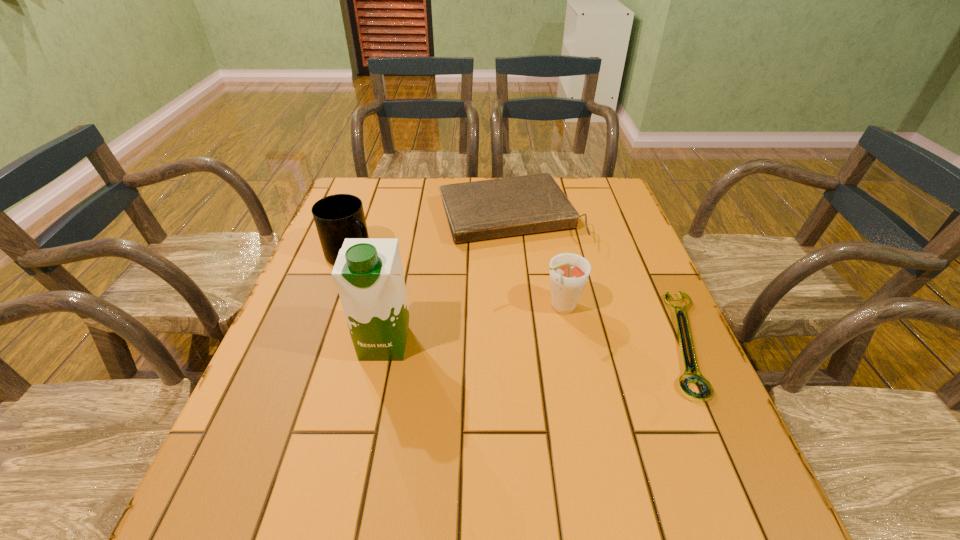
At what (x,y) coordinates should I click in order to perform the action: click on wrench situated at the right edge. Please return your answer as a coordinate pair (x, y). Image resolution: width=960 pixels, height=540 pixels. Looking at the image, I should click on (697, 378).

Identify the location of paperback book present at the right edge. The height and width of the screenshot is (540, 960). (478, 210).

Locate an element on the screen. The width and height of the screenshot is (960, 540). object present at the far right corner is located at coordinates (478, 210).

In the image, there is a desktop. Identify the location of vacant space at the near edge. Image resolution: width=960 pixels, height=540 pixels. (333, 421).

Identify the location of free space at the left edge. (336, 346).

This screenshot has width=960, height=540. In order to click on blank area at the right edge in this screenshot , I will do `click(629, 227)`.

You are a GUI agent. You are given a task and a screenshot of the screen. Output one action in this format:
    pyautogui.click(x=<x>, y=<y>)
    Task: Click on the free location at the near right corner of the desktop
    The image size is (960, 540).
    Given the screenshot: What is the action you would take?
    pyautogui.click(x=716, y=452)

This screenshot has width=960, height=540. Identify the location of free point between the root beer and the second shortest object. (535, 261).

The image size is (960, 540). I want to click on free space between the paperback book and the root beer, so click(535, 261).

At what (x,y) coordinates should I click in order to perform the action: click on free point between the tallest object and the shortest object. Please return your answer as a coordinate pair (x, y). Looking at the image, I should click on (535, 343).